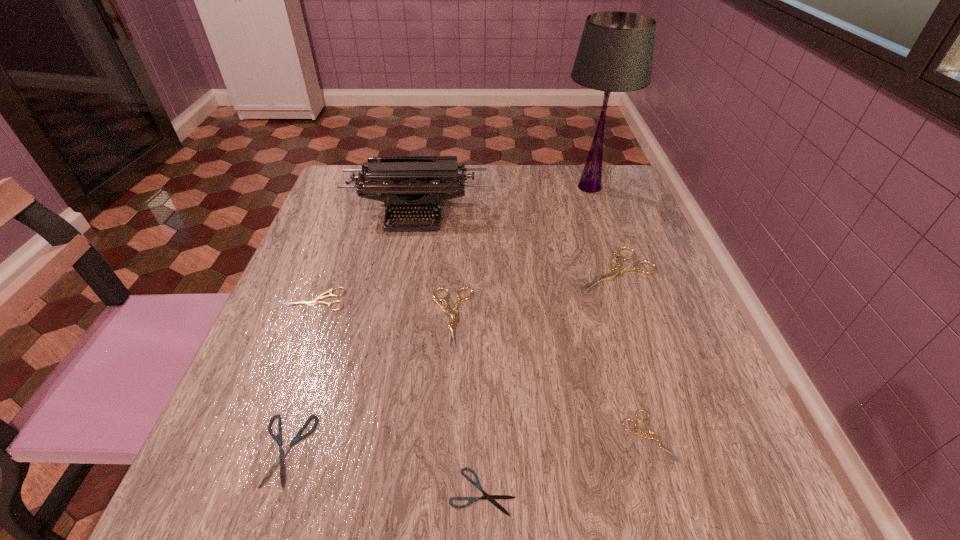
Where is `free area in between the tallest object and the smaller black shears`? free area in between the tallest object and the smaller black shears is located at coordinates (536, 339).

You are a GUI agent. You are given a task and a screenshot of the screen. Output one action in this format:
    pyautogui.click(x=<x>, y=<y>)
    Task: Click on the vacant point located between the sixth shortest object and the third biggest beige shears
    The width and height of the screenshot is (960, 540).
    Given the screenshot: What is the action you would take?
    466,285

Identify which object is the sixth nearest to the tallest shears. Please provide its 2D coordinates. Your answer should be formatted as a tuple, i.e. [(x, y)], where the tuple contains the x and y coordinates of a point satisfying the conditions above.

[(315, 301)]

Select which object is the sixth closest to the third biggest beige shears. Please provide its 2D coordinates. Your answer should be formatted as a tuple, i.e. [(x, y)], where the tuple contains the x and y coordinates of a point satisfying the conditions above.

[(651, 435)]

Image resolution: width=960 pixels, height=540 pixels. I want to click on shears that is the fourth nearest to the fifth shortest object, so click(x=615, y=272).

At what (x,y) coordinates should I click in order to perform the action: click on shears that is the third closest one to the leftmost beige shears. Please return your answer as a coordinate pair (x, y). The height and width of the screenshot is (540, 960). Looking at the image, I should click on (490, 498).

The image size is (960, 540). What are the coordinates of `the fourth closest beige shears to the tallest object` in the screenshot? It's located at (651, 435).

Locate which beige shears is the closest to the typewriter. Please provide its 2D coordinates. Your answer should be formatted as a tuple, i.e. [(x, y)], where the tuple contains the x and y coordinates of a point satisfying the conditions above.

[(315, 301)]

Locate an element on the screen. The height and width of the screenshot is (540, 960). blank space that satisfies the following two spatial constraints: 1. on the back side of the smallest beige shears; 2. on the left side of the left black shears is located at coordinates (290, 436).

Identify the location of vacant space that satisfies the following two spatial constraints: 1. on the typing side of the typewriter; 2. on the right side of the shortest object. The height and width of the screenshot is (540, 960). tap(365, 492).